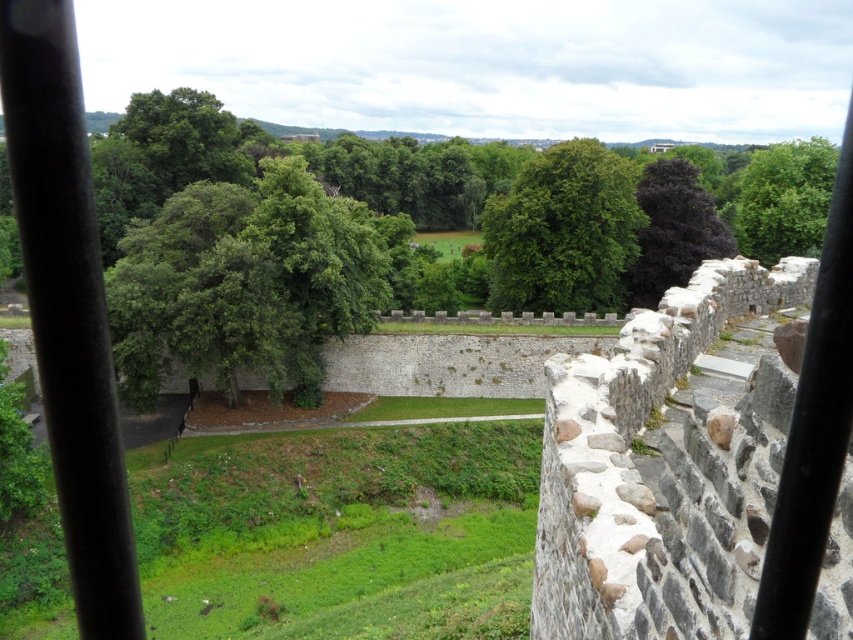
Does green leafy tree at upper right appear on the right side of dark purple leafy tree at upper right?

Yes, green leafy tree at upper right is to the right of dark purple leafy tree at upper right.

Consider the image. Is green leafy tree at upper right shorter than dark purple leafy tree at upper right?

No.

Between point (817, 157) and point (676, 161), which one is positioned in front?

Point (676, 161) is in front.

Where is `green leafy tree at upper right`? This screenshot has width=853, height=640. green leafy tree at upper right is located at coordinates (784, 198).

Does green leafy tree at center have a lesser width compared to dark purple leafy tree at upper right?

In fact, green leafy tree at center might be wider than dark purple leafy tree at upper right.

Is green leafy tree at center further to camera compared to dark purple leafy tree at upper right?

No, green leafy tree at center is closer to the viewer.

The width and height of the screenshot is (853, 640). In order to click on green leafy tree at center in this screenshot , I will do `click(563, 230)`.

Where is `green leafy tree at center`? green leafy tree at center is located at coordinates (563, 230).

At what (x,y) coordinates should I click in order to perform the action: click on green leafy tree at center. Please return your answer as a coordinate pair (x, y). Looking at the image, I should click on (563, 230).

Is green leafy tree at center to the right of green leafy tree at upper right from the viewer's perspective?

In fact, green leafy tree at center is to the left of green leafy tree at upper right.

Does point (509, 250) lie behind point (782, 170)?

No, (509, 250) is closer to viewer.

The image size is (853, 640). Identify the location of green leafy tree at center. (563, 230).